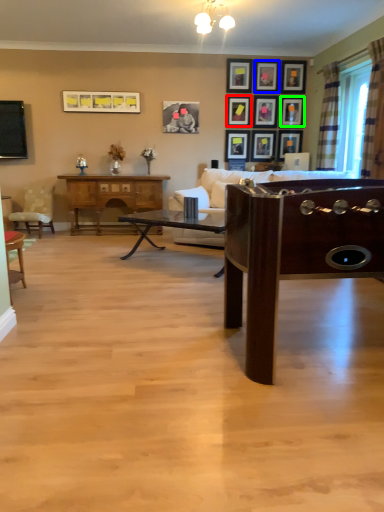
Question: Considering the real-world distances, which object is closest to picture frame (highlighted by a red box)? picture frame (highlighted by a blue box) or picture frame (highlighted by a green box).

Choices:
 (A) picture frame
 (B) picture frame

Answer: (A)